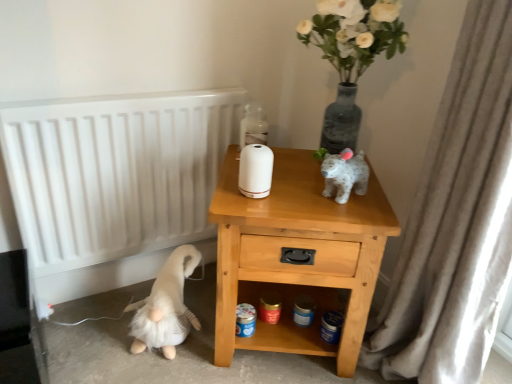
What are the coordinates of `spots to the right of white plush gnome at lower left` in the screenshot? It's located at pos(212,355).